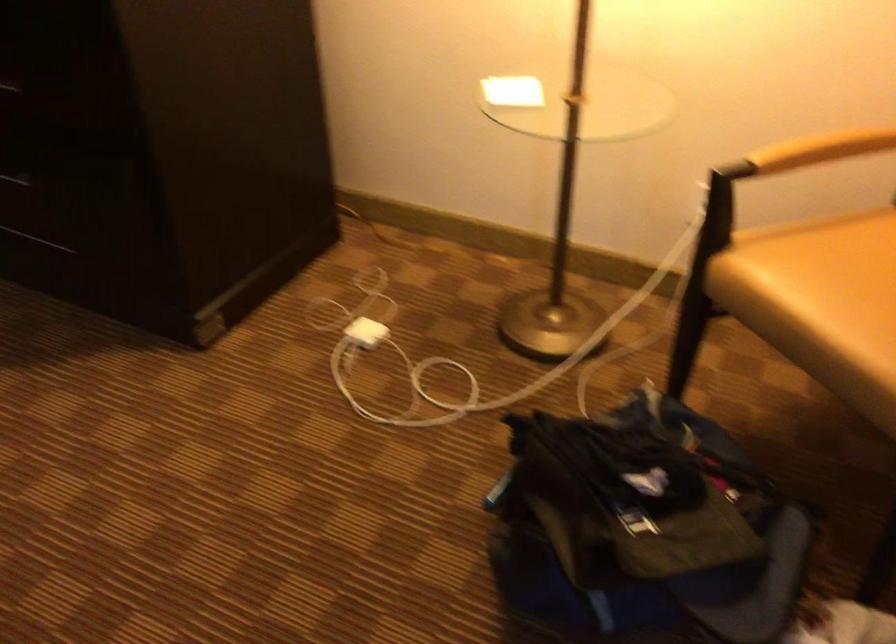
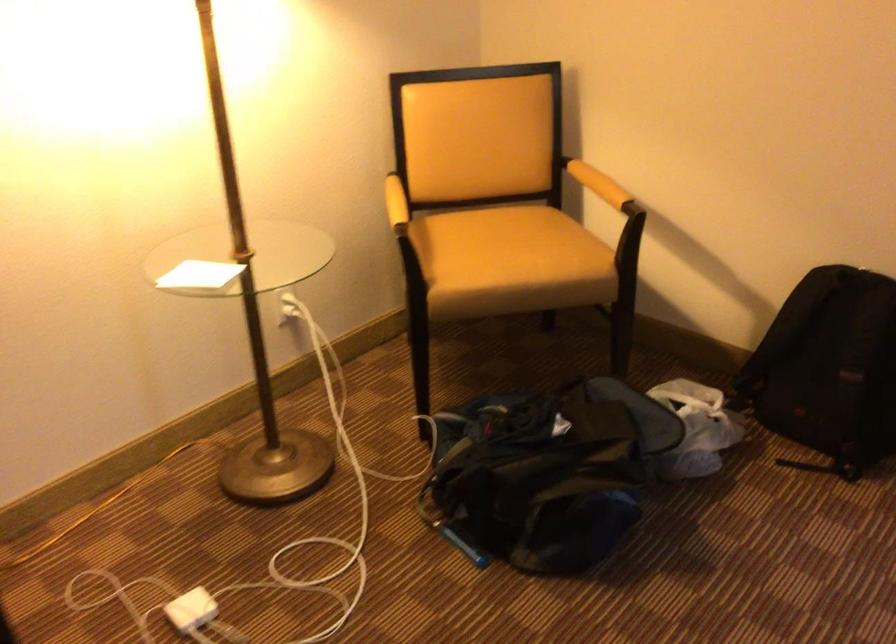
In the second image, find the point that corresponds to point (554, 482) in the first image.

(537, 480)